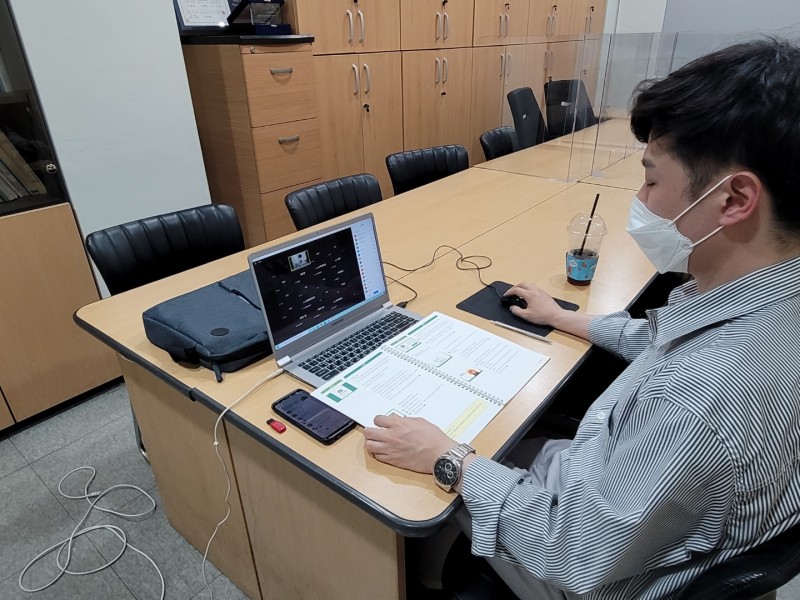
Where is `4 desk`? The width and height of the screenshot is (800, 600). 4 desk is located at coordinates (565, 232), (614, 172), (566, 154), (492, 220).